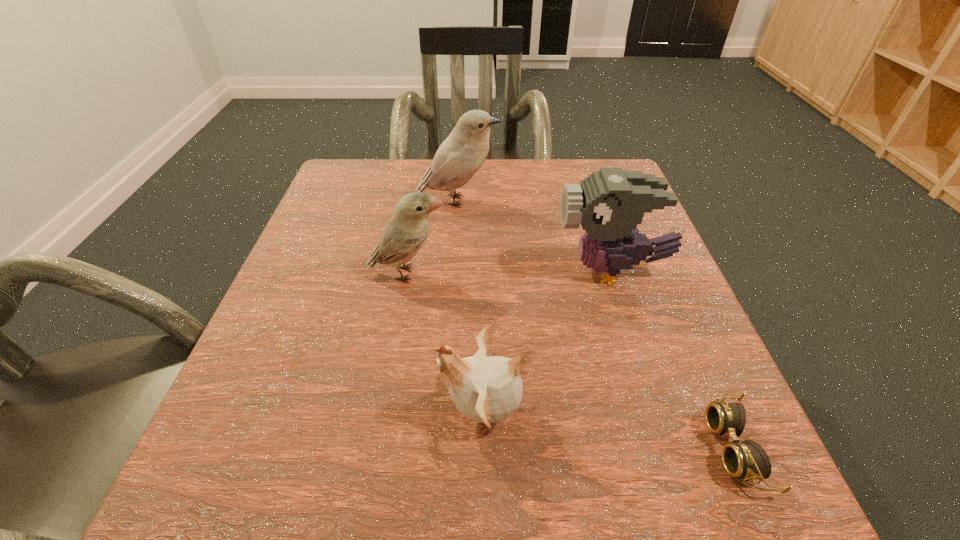
Locate an element on the screen. The width and height of the screenshot is (960, 540). vacant point located between the goggles and the nearest bird is located at coordinates (609, 430).

Identify which object is the second nearest to the farthest bird. Please provide its 2D coordinates. Your answer should be formatted as a tuple, i.e. [(x, y)], where the tuple contains the x and y coordinates of a point satisfying the conditions above.

[(609, 203)]

You are a GUI agent. You are given a task and a screenshot of the screen. Output one action in this format:
    pyautogui.click(x=<x>, y=<y>)
    Task: Click on the object that stands as the third closest to the farthest object
    The height and width of the screenshot is (540, 960).
    Given the screenshot: What is the action you would take?
    pyautogui.click(x=487, y=389)

Identify which bird is located as the second nearest to the rightmost bird. Please provide its 2D coordinates. Your answer should be formatted as a tuple, i.e. [(x, y)], where the tuple contains the x and y coordinates of a point satisfying the conditions above.

[(459, 157)]

Locate an element on the screen. bird that stands as the second closest to the rightmost bird is located at coordinates (459, 157).